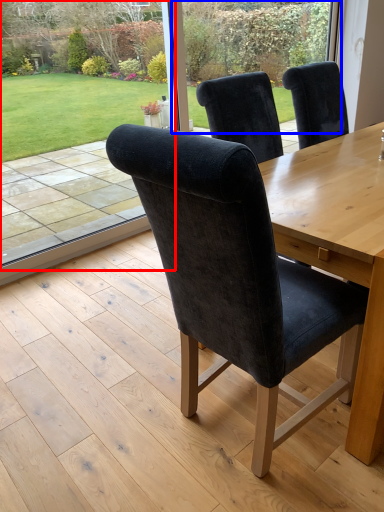
Question: Among these objects, which one is nearest to the camera, window screen (highlighted by a red box) or glass door (highlighted by a blue box)?

Choices:
 (A) window screen
 (B) glass door

Answer: (A)